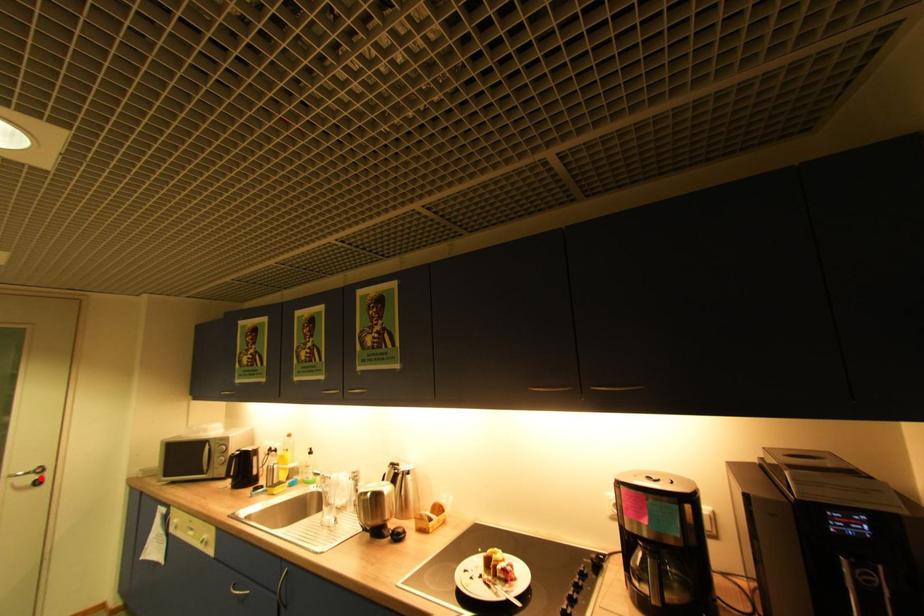
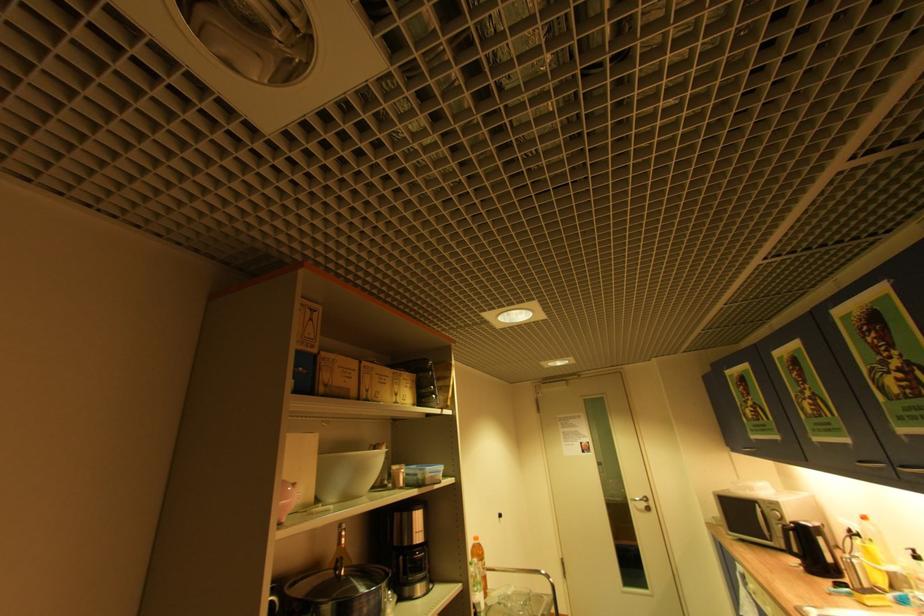
The point at the highlighted location is marked in the first image. Where is the corresponding point in the second image?

(650, 505)